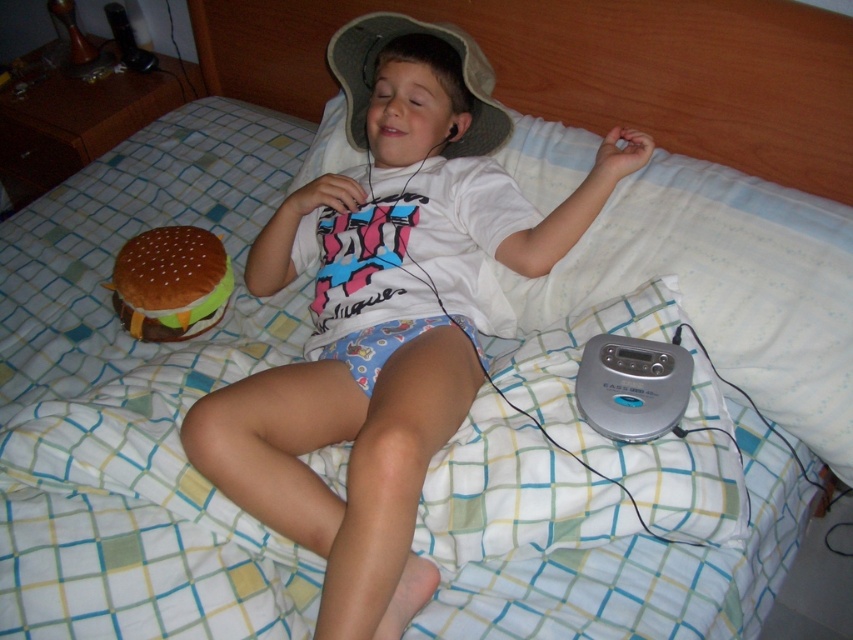
Based on the scene description, where is the white cotton shirt at center located in terms of coordinates?

The white cotton shirt at center is located at coordinates point (386, 314).

Where is the white cotton shirt at center located in the image?

The white cotton shirt at center is located at point coordinates of 0.492 on the x axis and 0.453 on the y axis.